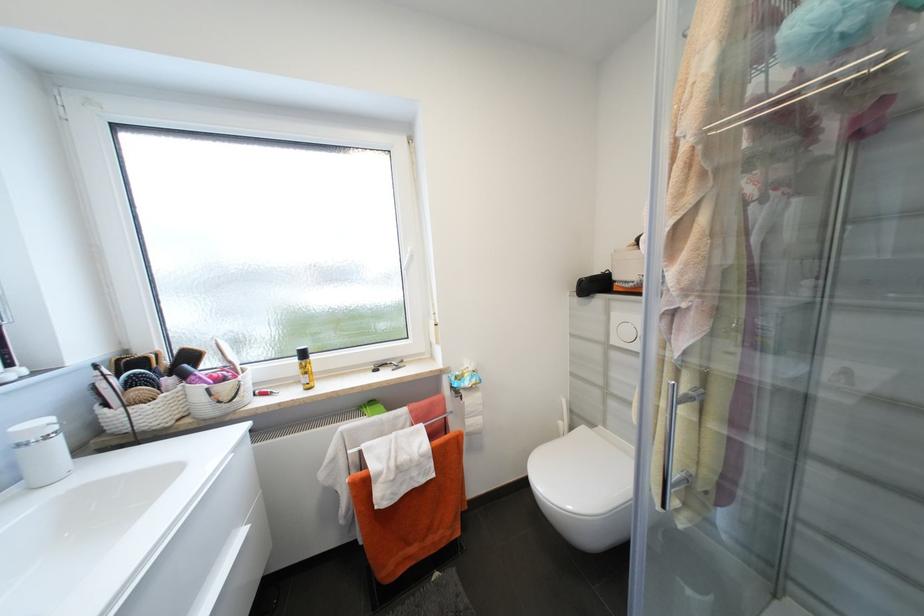
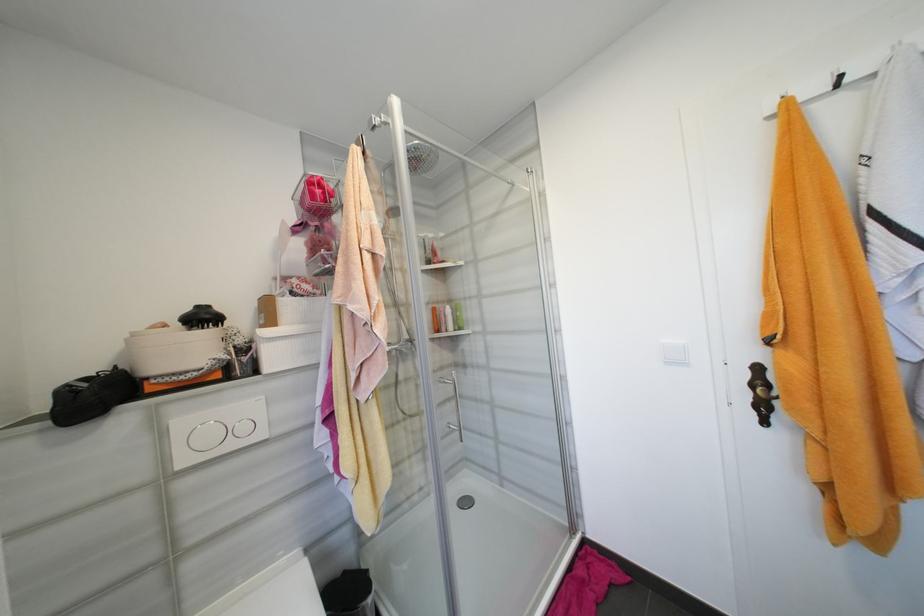
Question: The camera is either moving clockwise (left) or counter-clockwise (right) around the object. The first image is from the beginning of the video and the second image is from the end. Is the camera moving left or right when shooting the video?

Choices:
 (A) Left
 (B) Right

Answer: (A)